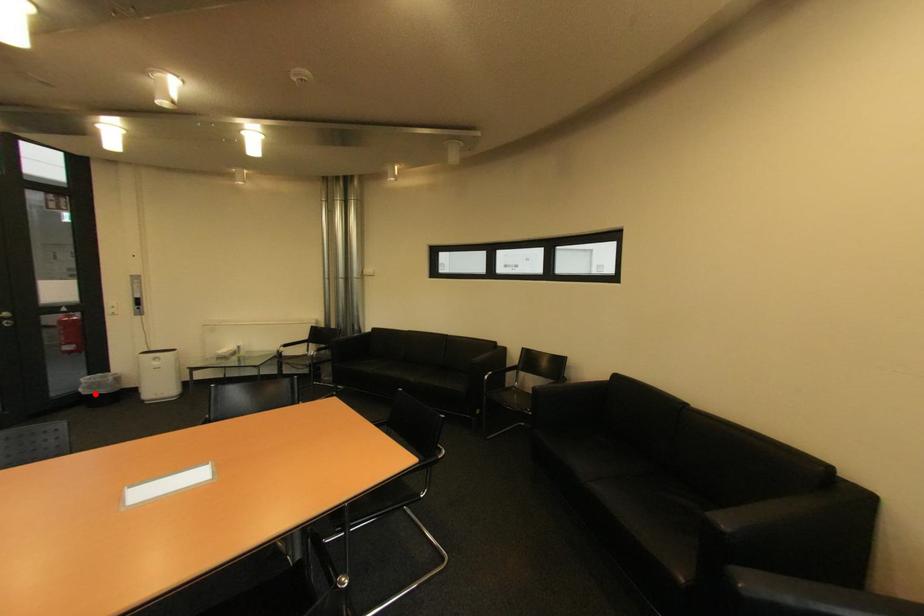
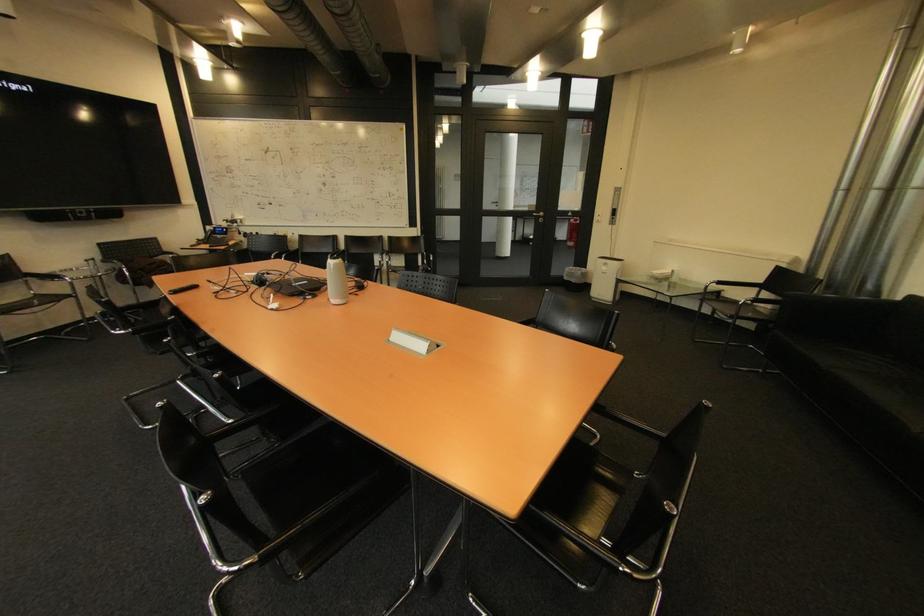
Question: I am providing you with two images of the same scene from different viewpoints. Image1 has a red point marked. In image2, the corresponding 3D location appears at what relative position? Reply with the corresponding letter.

Choices:
 (A) Closer
 (B) Farther

Answer: (A)